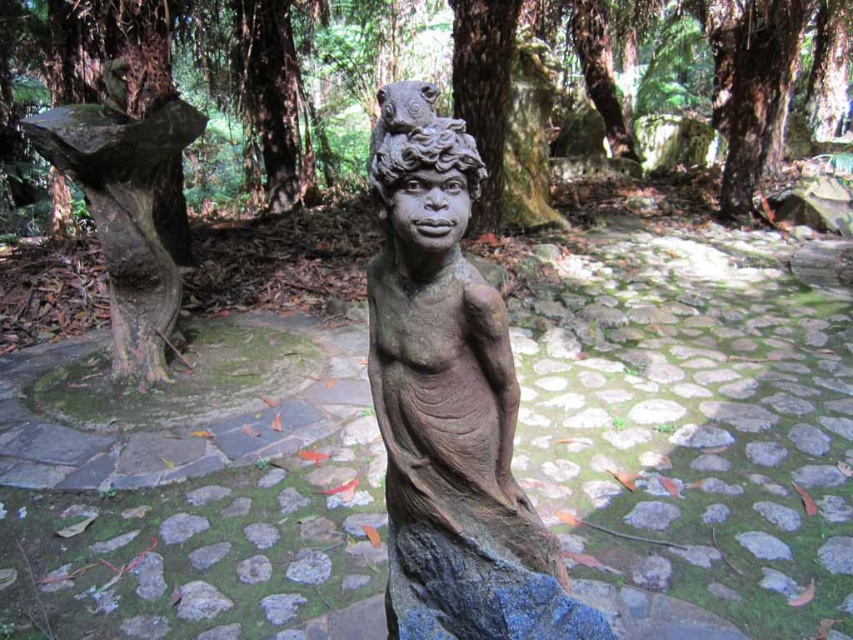
Which is in front, point (454, 140) or point (489, 88)?

Positioned in front is point (454, 140).

Does brown stone statue at center have a larger size compared to smooth bark tree trunk at center?

Actually, brown stone statue at center might be smaller than smooth bark tree trunk at center.

Consider the image. Who is more forward, (378, 355) or (845, 3)?

Point (378, 355) is in front.

Where is `brown stone statue at center`? The height and width of the screenshot is (640, 853). brown stone statue at center is located at coordinates point(448,401).

Is point (434, 138) farther from viewer compared to point (128, 252)?

No, (434, 138) is closer to viewer.

Which is above, brown stone statue at center or green mossy tree stump at left?

green mossy tree stump at left is above.

Identify the location of brown stone statue at center. The image size is (853, 640). (448, 401).

Locate an element on the screen. This screenshot has height=640, width=853. smooth bark tree trunk at center is located at coordinates (151, 60).

Can you confirm if smooth bark tree trunk at center is thinner than green mossy tree stump at left?

Correct, smooth bark tree trunk at center's width is less than green mossy tree stump at left's.

Locate an element on the screen. smooth bark tree trunk at center is located at coordinates (151, 60).

Image resolution: width=853 pixels, height=640 pixels. I want to click on smooth bark tree trunk at center, so click(151, 60).